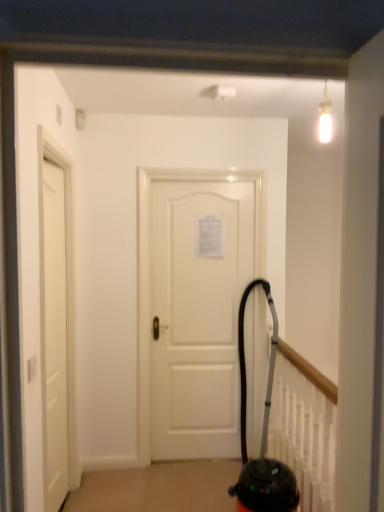
What is the approximate width of black rubber vacuum cleaner at center?

35.47 inches.

The width and height of the screenshot is (384, 512). Describe the element at coordinates (262, 439) in the screenshot. I see `black rubber vacuum cleaner at center` at that location.

Describe the element at coordinates (54, 339) in the screenshot. I see `white matte door at left, the second door from the right` at that location.

Identify the location of black rubber vacuum cleaner at center. The height and width of the screenshot is (512, 384). (262, 439).

Looking at this image, is white matte door at center, marked as the 2th door in a front-to-back arrangement, not close to white matte door at left, which is counted as the 1th door, starting from the left?

white matte door at center, marked as the 2th door in a front-to-back arrangement, is actually quite close to white matte door at left, which is counted as the 1th door, starting from the left.

Locate an element on the screen. This screenshot has height=512, width=384. door located above the white matte door at left, which is the second door from back to front (from the image's perspective) is located at coordinates (198, 314).

Based on the photo, considering the relative sizes of white matte door at center, marked as the 2th door in a front-to-back arrangement, and white matte door at left, the second door from the right, in the image provided, is white matte door at center, marked as the 2th door in a front-to-back arrangement, wider than white matte door at left, the second door from the right,?

No, white matte door at center, marked as the 2th door in a front-to-back arrangement, is not wider than white matte door at left, the second door from the right.

Can you confirm if white matte door at center, acting as the first door starting from the right, is bigger than white matte door at left, which is counted as the 1th door, starting from the left?

Actually, white matte door at center, acting as the first door starting from the right, might be smaller than white matte door at left, which is counted as the 1th door, starting from the left.

Does point (61, 383) come behind point (175, 256)?

No, it is not.

Is white matte door at center, marked as the 2th door in a front-to-back arrangement, at the back of white matte door at left, arranged as the first door when viewed from the front?

That's not correct — white matte door at left, arranged as the first door when viewed from the front, is not looking away from white matte door at center, marked as the 2th door in a front-to-back arrangement.

From the picture: Considering the relative sizes of white matte door at left, which is the second door from back to front, and white matte door at center, marked as the 2th door in a front-to-back arrangement, in the image provided, is white matte door at left, which is the second door from back to front, thinner than white matte door at center, marked as the 2th door in a front-to-back arrangement,?

In fact, white matte door at left, which is the second door from back to front, might be wider than white matte door at center, marked as the 2th door in a front-to-back arrangement.

How different are the orientations of white matte door at left, the second door from the right, and white matte door at center, acting as the first door starting from the right, in degrees?

91 degrees separate the facing orientations of white matte door at left, the second door from the right, and white matte door at center, acting as the first door starting from the right.

Can you confirm if white matte door at left, which is the second door from back to front, is bigger than black rubber vacuum cleaner at center?

No, white matte door at left, which is the second door from back to front, is not bigger than black rubber vacuum cleaner at center.

From the image's perspective, is white matte door at left, the second door from the right, beneath black rubber vacuum cleaner at center?

No, from the image's perspective, white matte door at left, the second door from the right, is not below black rubber vacuum cleaner at center.

Considering the positions of points (59, 340) and (272, 362), is point (59, 340) farther from camera compared to point (272, 362)?

No, it is not.

Who is more distant, white matte door at left, arranged as the first door when viewed from the front, or black rubber vacuum cleaner at center?

black rubber vacuum cleaner at center is further away from the camera.

Is black rubber vacuum cleaner at center bigger than white matte door at left, which is counted as the 1th door, starting from the left?

Correct, black rubber vacuum cleaner at center is larger in size than white matte door at left, which is counted as the 1th door, starting from the left.

From a real-world perspective, count 1st doors upward from the black rubber vacuum cleaner at center and point to it. Please provide its 2D coordinates.

[(54, 339)]

From the image's perspective, relative to white matte door at left, which is counted as the 1th door, starting from the left, is black rubber vacuum cleaner at center above or below?

black rubber vacuum cleaner at center is situated lower than white matte door at left, which is counted as the 1th door, starting from the left, in the image.

Does point (187, 198) come behind point (258, 459)?

Yes, it is.

Which of these two, white matte door at center, marked as the 2th door in a front-to-back arrangement, or black rubber vacuum cleaner at center, is wider?

With larger width is black rubber vacuum cleaner at center.

In the image, is white matte door at center, acting as the first door starting from the right, positioned in front of or behind black rubber vacuum cleaner at center?

white matte door at center, acting as the first door starting from the right, is behind black rubber vacuum cleaner at center.

Who is smaller, black rubber vacuum cleaner at center or white matte door at center, acting as the first door starting from the right?

white matte door at center, acting as the first door starting from the right, is smaller.

Locate an element on the screen. extinguisher below the white matte door at center, marked as the 2th door in a front-to-back arrangement (from the image's perspective) is located at coordinates (262, 439).

From the picture: Is black rubber vacuum cleaner at center at the right side of white matte door at center, marked as the 2th door in a front-to-back arrangement?

Indeed, black rubber vacuum cleaner at center is positioned on the right side of white matte door at center, marked as the 2th door in a front-to-back arrangement.

Locate an element on the screen. door beneath the white matte door at center, acting as the first door starting from the right (from a real-world perspective) is located at coordinates (54, 339).

I want to click on door on the right of white matte door at left, the second door from the right, so click(198, 314).

Looking at the image, which one is located closer to white matte door at center, the first door viewed from the back, black rubber vacuum cleaner at center or white matte door at left, arranged as the first door when viewed from the front?

black rubber vacuum cleaner at center is closer to white matte door at center, the first door viewed from the back.

When comparing their distances from black rubber vacuum cleaner at center, does white matte door at center, the first door viewed from the back, or white matte door at left, which is counted as the 1th door, starting from the left, seem further?

white matte door at left, which is counted as the 1th door, starting from the left, is positioned further to the anchor black rubber vacuum cleaner at center.

From the image, which object appears to be nearer to black rubber vacuum cleaner at center, white matte door at left, which is counted as the 1th door, starting from the left, or white matte door at center, the first door viewed from the back?

The object closer to black rubber vacuum cleaner at center is white matte door at center, the first door viewed from the back.

Estimate the real-world distances between objects in this image. Which object is further from white matte door at center, the first door viewed from the back, white matte door at left, which is the second door from back to front, or black rubber vacuum cleaner at center?

Based on the image, white matte door at left, which is the second door from back to front, appears to be further to white matte door at center, the first door viewed from the back.

When comparing their distances from white matte door at left, arranged as the first door when viewed from the front, does white matte door at center, marked as the 2th door in a front-to-back arrangement, or black rubber vacuum cleaner at center seem closer?

The object closer to white matte door at left, arranged as the first door when viewed from the front, is white matte door at center, marked as the 2th door in a front-to-back arrangement.

Based on their spatial positions, is black rubber vacuum cleaner at center or white matte door at center, acting as the first door starting from the right, closer to white matte door at left, which is counted as the 1th door, starting from the left?

Based on the image, white matte door at center, acting as the first door starting from the right, appears to be nearer to white matte door at left, which is counted as the 1th door, starting from the left.

Locate an element on the screen. This screenshot has height=512, width=384. door between white matte door at left, which is the second door from back to front, and black rubber vacuum cleaner at center from left to right is located at coordinates (198, 314).